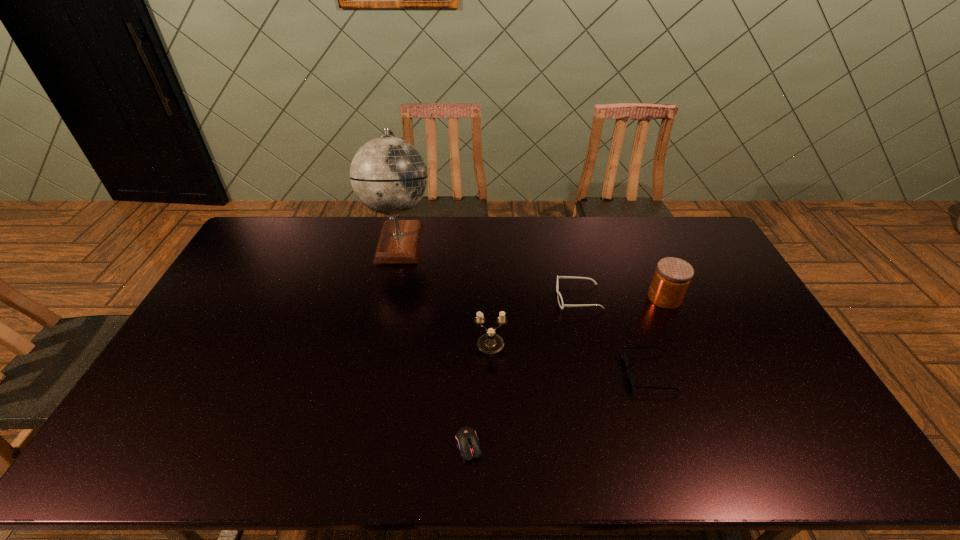
Image resolution: width=960 pixels, height=540 pixels. I want to click on free space between the leftmost object and the fifth object from left to right, so point(525,307).

Where is `free spot between the fifth object from left to right and the rightmost object`? This screenshot has height=540, width=960. free spot between the fifth object from left to right and the rightmost object is located at coordinates (657, 335).

Identify the location of free area in between the candle holder and the rightmost object. The image size is (960, 540). (578, 321).

I want to click on free space between the nearest object and the farthest object, so click(434, 343).

Choose which object is the fourth nearest neighbor to the farthest object. Please provide its 2D coordinates. Your answer should be formatted as a tuple, i.e. [(x, y)], where the tuple contains the x and y coordinates of a point satisfying the conditions above.

[(632, 377)]

Identify which object is the fifth nearest to the globe. Please provide its 2D coordinates. Your answer should be formatted as a tuple, i.e. [(x, y)], where the tuple contains the x and y coordinates of a point satisfying the conditions above.

[(672, 277)]

Where is `free region that satisfies the following two spatial constraints: 1. with the lenses of the jar facing outward; 2. on the right side of the taller sunglasses`? This screenshot has height=540, width=960. free region that satisfies the following two spatial constraints: 1. with the lenses of the jar facing outward; 2. on the right side of the taller sunglasses is located at coordinates (578, 298).